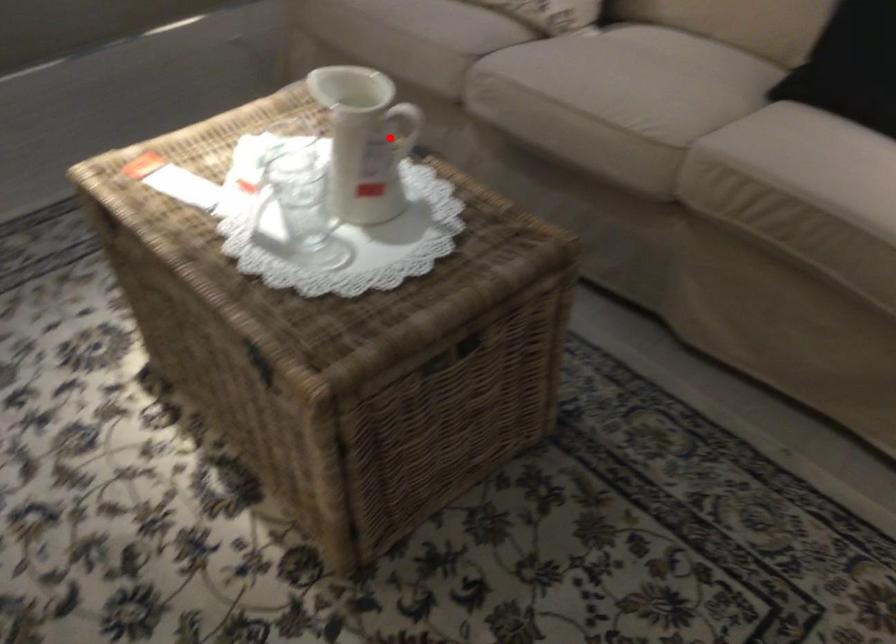
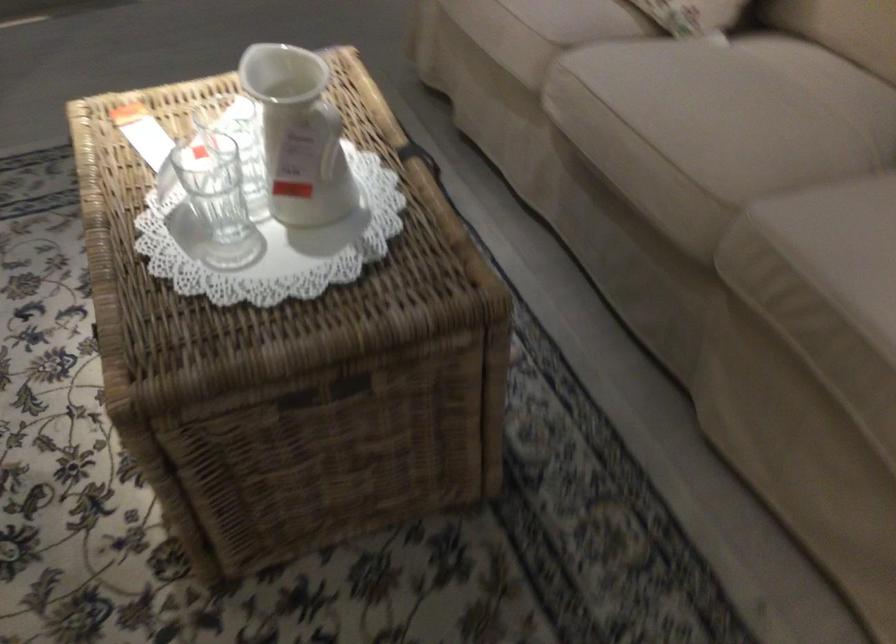
Find the pixel in the second image that matches the highlighted location in the first image.

(328, 137)